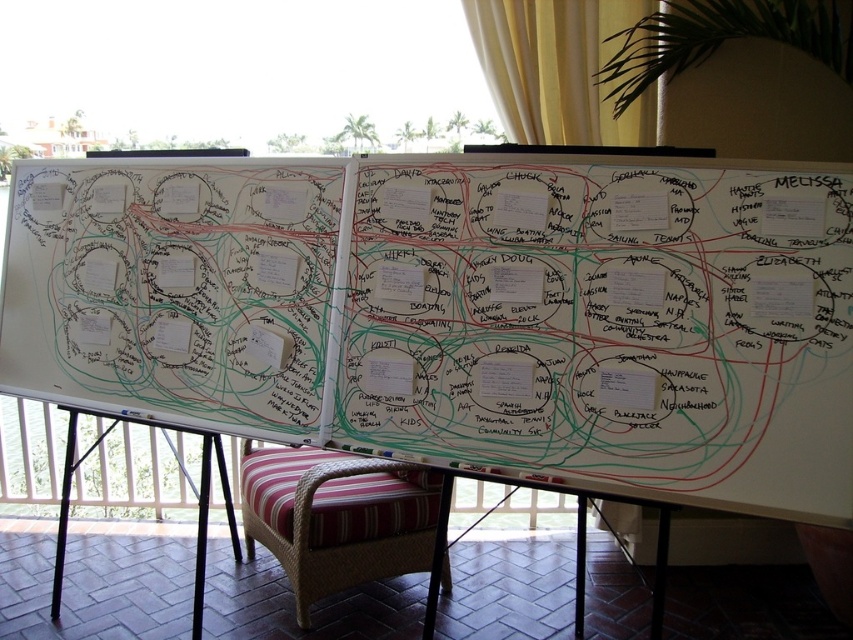
Who is more distant from viewer, (728, 285) or (338, 483)?

The point (338, 483) is behind.

Can you confirm if whiteboard at center is positioned to the right of striped fabric cushion at lower center?

Correct, you'll find whiteboard at center to the right of striped fabric cushion at lower center.

The image size is (853, 640). Find the location of `whiteboard at center`. whiteboard at center is located at coordinates (457, 312).

The width and height of the screenshot is (853, 640). Find the location of `whiteboard at center`. whiteboard at center is located at coordinates (457, 312).

Does whiteboard at center appear on the left side of yellow fabric curtain at upper center?

Correct, you'll find whiteboard at center to the left of yellow fabric curtain at upper center.

Is point (233, 170) positioned after point (548, 1)?

That is False.

Identify the location of whiteboard at center. (457, 312).

Where is `whiteboard at center`? Image resolution: width=853 pixels, height=640 pixels. whiteboard at center is located at coordinates (457, 312).

Between striped fabric cushion at lower center and yellow fabric curtain at upper center, which one is positioned higher?

yellow fabric curtain at upper center is higher up.

Is striped fabric cushion at lower center positioned before yellow fabric curtain at upper center?

Yes, it is.

Is point (292, 557) closer to viewer compared to point (505, 106)?

Yes, point (292, 557) is in front of point (505, 106).

Identify the location of striped fabric cushion at lower center. This screenshot has width=853, height=640. (335, 516).